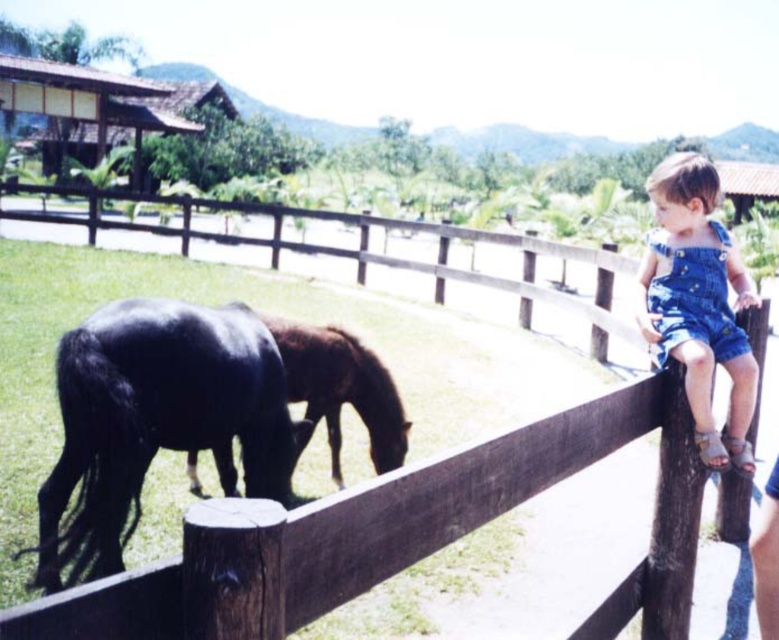
Which is above, denim overalls at upper right or shiny brown horse at center?

denim overalls at upper right

Between denim overalls at upper right and shiny brown horse at center, which one has more height?

denim overalls at upper right is taller.

Find the location of `denim overalls at upper right`. denim overalls at upper right is located at coordinates (696, 301).

Between shiny black horse at lower left and shiny brown horse at center, which one is positioned higher?

shiny brown horse at center

Is shiny black horse at lower left further to the viewer compared to shiny brown horse at center?

No, it is in front of shiny brown horse at center.

Measure the distance between shiny black horse at lower left and camera.

shiny black horse at lower left is 2.92 meters from camera.

Where is `shiny black horse at lower left`? shiny black horse at lower left is located at coordinates (157, 420).

Where is `shiny black horse at lower left`? shiny black horse at lower left is located at coordinates (157, 420).

Is point (210, 332) in front of point (665, 332)?

No, (210, 332) is behind (665, 332).

Is point (87, 474) farther from camera compared to point (695, 200)?

No.

At what (x,y) coordinates should I click in order to perform the action: click on shiny black horse at lower left. Please return your answer as a coordinate pair (x, y). Looking at the image, I should click on (157, 420).